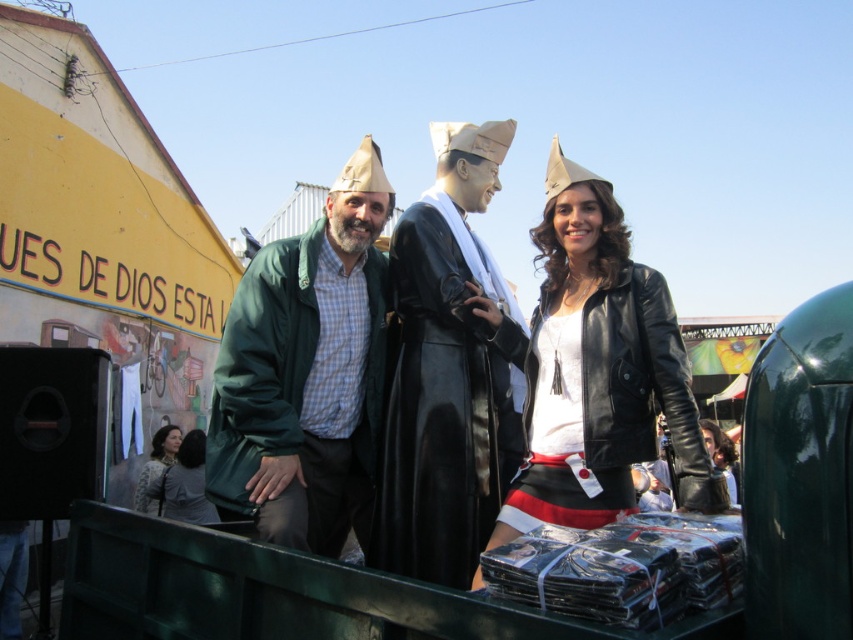
You are a photographer at the event and need to capture a clear photo of the shiny black coat at center and the leather jacket at center. Based on their positions, which one is closer to the camera?

The shiny black coat at center is positioned under the leather jacket at center, so the leather jacket at center is closer to the camera.

You are a photographer at the event and need to position two subjects for a photo. The green matte jacket at center and the leather jacket at center are both in the frame. Which subject should you direct to move to the right to create space between them?

The green matte jacket at center is to the left of the leather jacket at center. To create space between them, you should direct the green matte jacket at center to move to the right.

You are planning to take a photo of the matte black coat at center and the green matte jacket at center. Which one of them has a wider width?

The green matte jacket at center is wider than the matte black coat at center.